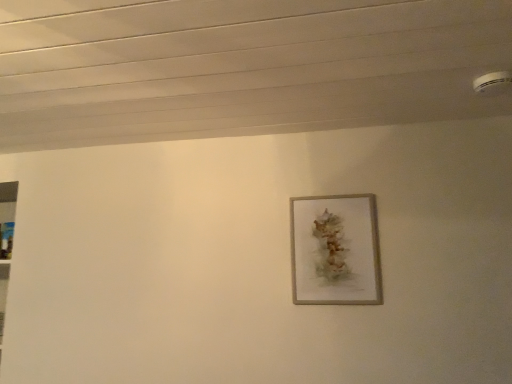
I want to click on matte gray picture frame at center, so click(335, 250).

What do you see at coordinates (335, 250) in the screenshot? The image size is (512, 384). I see `matte gray picture frame at center` at bounding box center [335, 250].

This screenshot has height=384, width=512. In order to click on matte gray picture frame at center in this screenshot , I will do `click(335, 250)`.